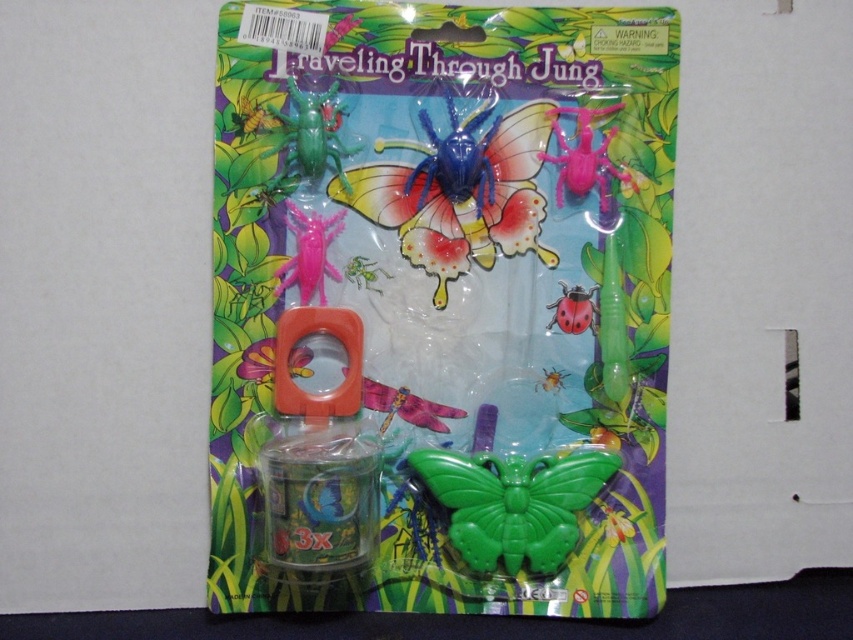
Who is lower down, green matte insect at upper center or matte red ladybug at center?

matte red ladybug at center is below.

Is point (279, 173) positioned behind point (555, 321)?

No, it is not.

Is point (302, 138) positioned before point (582, 307)?

Yes, point (302, 138) is in front of point (582, 307).

Find the location of a particular element. This screenshot has width=853, height=640. green matte insect at upper center is located at coordinates (309, 138).

Looking at this image, is translucent plastic butterfly at center taller than pink plastic spider at upper right?

Yes, translucent plastic butterfly at center is taller than pink plastic spider at upper right.

Who is more forward, (521,152) or (583,141)?

Point (583,141) is more forward.

At what (x,y) coordinates should I click in order to perform the action: click on translucent plastic butterfly at center. Please return your answer as a coordinate pair (x, y). The width and height of the screenshot is (853, 640). Looking at the image, I should click on (460, 193).

Is green matte butterfly at center to the right of green matte insect at upper center from the viewer's perspective?

Indeed, green matte butterfly at center is positioned on the right side of green matte insect at upper center.

Is green matte butterfly at center thinner than green matte insect at upper center?

No.

Is point (434, 476) in front of point (317, 134)?

Yes.

The image size is (853, 640). Find the location of `green matte butterfly at center`. green matte butterfly at center is located at coordinates (514, 502).